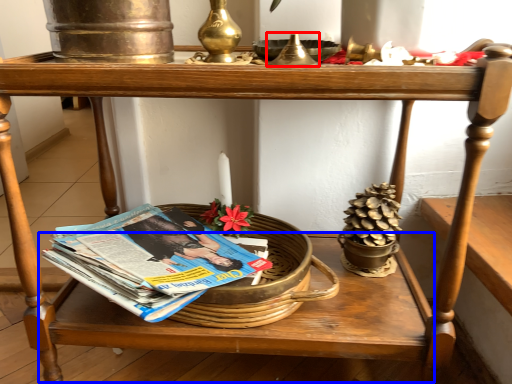
Question: Which object appears farthest to the camera in this image, candle holder (highlighted by a red box) or table (highlighted by a blue box)?

Choices:
 (A) candle holder
 (B) table

Answer: (B)